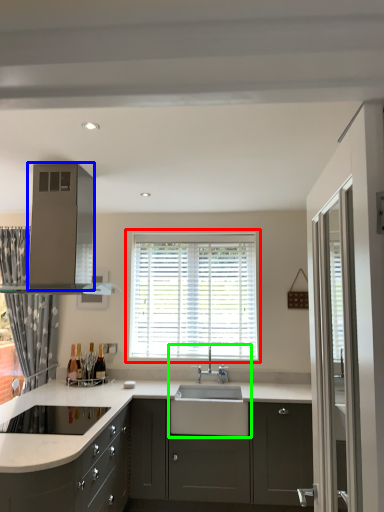
Question: Which is farther away from window (highlighted by a red box)? appliance (highlighted by a blue box) or sink (highlighted by a green box)?

Choices:
 (A) appliance
 (B) sink

Answer: (A)